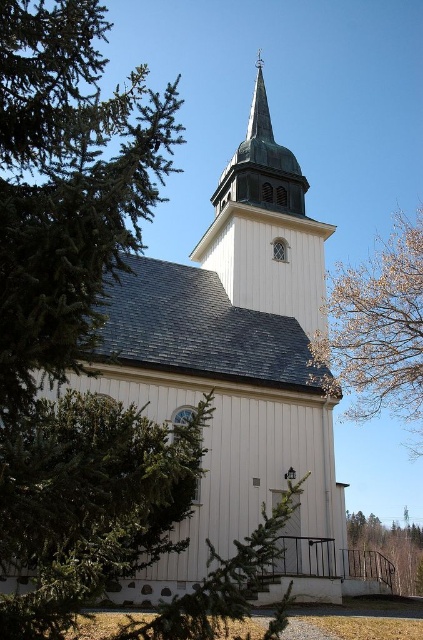
Does white wooden church at center appear on the right side of white wooden steeple at upper center?

Yes, white wooden church at center is to the right of white wooden steeple at upper center.

Looking at this image, does white wooden church at center have a greater width compared to white wooden steeple at upper center?

Yes.

Who is more distant from viewer, [134,296] or [301,228]?

Positioned behind is point [301,228].

Find the location of a particular element. white wooden church at center is located at coordinates (236, 362).

Can you confirm if white wooden steeple at upper center is positioned to the right of bare branches at upper right?

Incorrect, white wooden steeple at upper center is not on the right side of bare branches at upper right.

Does white wooden steeple at upper center have a lesser width compared to bare branches at upper right?

Yes.

This screenshot has height=640, width=423. What are the coordinates of `white wooden steeple at upper center` in the screenshot? It's located at (266, 227).

Who is taller, green needle-like leaves at left or white wooden steeple at upper center?

green needle-like leaves at left

Which is more to the left, green needle-like leaves at left or white wooden steeple at upper center?

Positioned to the left is green needle-like leaves at left.

Which is behind, point (5, 330) or point (290, 176)?

Point (290, 176)

The width and height of the screenshot is (423, 640). In order to click on green needle-like leaves at left in this screenshot , I will do `click(66, 182)`.